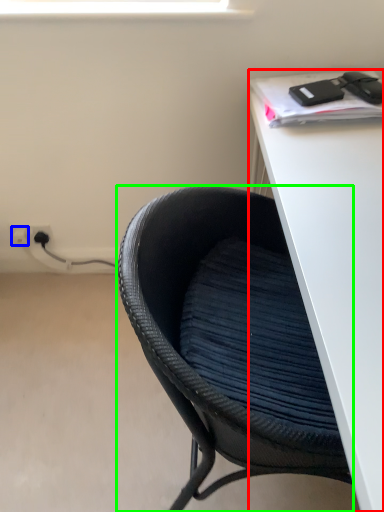
Question: Estimate the real-world distances between objects in this image. Which object is farther from desk (highlighted by a red box), electric outlet (highlighted by a blue box) or chair (highlighted by a green box)?

Choices:
 (A) electric outlet
 (B) chair

Answer: (A)